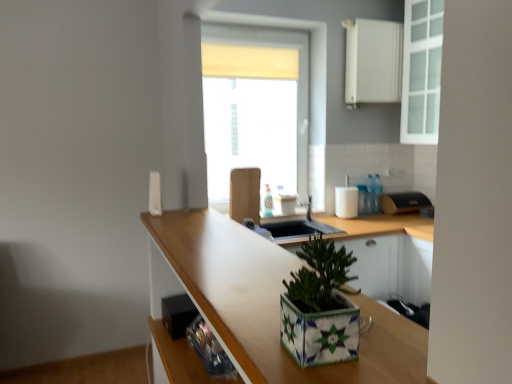
Question: From a real-world perspective, relative to white plastic remote at upper center, positioned as the 1th appliance in left-to-right order, is black plastic speaker at lower left, which is counted as the fourth appliance, starting from the right, vertically above or below?

Choices:
 (A) above
 (B) below

Answer: (B)

Question: From the image's perspective, relative to white plastic remote at upper center, marked as the fourth appliance in a bottom-to-top arrangement, is black plastic speaker at lower left, placed as the first appliance when sorted from front to back, above or below?

Choices:
 (A) above
 (B) below

Answer: (B)

Question: Estimate the real-world distances between objects in this image. Which object is closer to the translucent glass window at center?

Choices:
 (A) white matte soap dispenser at upper right, marked as the 3th appliance in a right-to-left arrangement
 (B) black plastic speaker at lower left, which is the first appliance in bottom-to-top order
 (C) wooden at center
 (D) white glass cabinet at upper right
 (E) black textured bread bin at right, which appears as the 5th appliance when viewed from the left

Answer: (A)

Question: Which of these objects is positioned farthest from the translucent glass window at center?

Choices:
 (A) white plastic remote at upper center, acting as the fifth appliance starting from the right
 (B) white glass cabinet at upper right
 (C) black plastic speaker at lower left, placed as the fifth appliance when sorted from back to front
 (D) white matte soap dispenser at upper right, marked as the 3th appliance in a right-to-left arrangement
 (E) white matte radiator at upper right, the fifth appliance ordered from the bottom

Answer: (C)